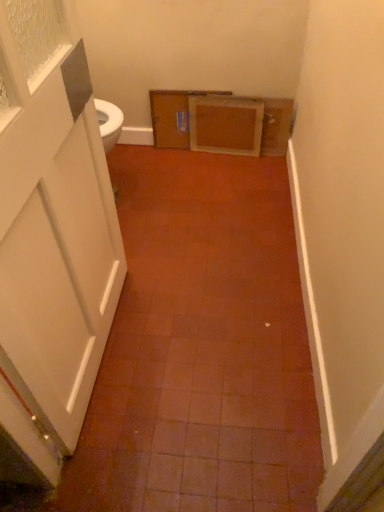
Locate an element on the screen. The width and height of the screenshot is (384, 512). wooden frame at center is located at coordinates (225, 125).

Describe the element at coordinates (225, 125) in the screenshot. I see `wooden frame at center` at that location.

What is the approximate height of wooden frame at center?

The height of wooden frame at center is 12.68 inches.

Where is `wooden frame at center`? The height and width of the screenshot is (512, 384). wooden frame at center is located at coordinates (225, 125).